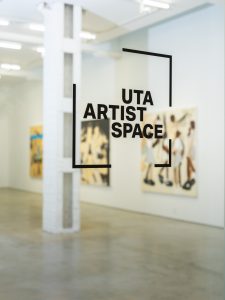
The image size is (225, 300). I want to click on white painted walls, so click(x=206, y=133), click(x=12, y=134).